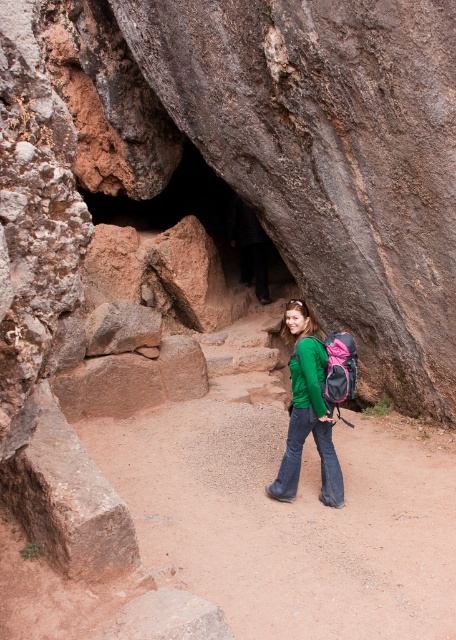
Question: Which point appears closest to the camera in this image?

Choices:
 (A) (294, 378)
 (B) (314, 436)

Answer: (A)

Question: Considering the relative positions of green matte shirt at center and green matte sweatshirt at center in the image provided, where is green matte shirt at center located with respect to green matte sweatshirt at center?

Choices:
 (A) left
 (B) right

Answer: (A)

Question: Which of the following is the farthest from the observer?

Choices:
 (A) (319, 378)
 (B) (295, 369)

Answer: (B)

Question: Is green matte shirt at center bigger than green matte sweatshirt at center?

Choices:
 (A) no
 (B) yes

Answer: (B)

Question: Which of the following is the farthest from the observer?

Choices:
 (A) (310, 392)
 (B) (322, 468)

Answer: (B)

Question: Can you confirm if green matte shirt at center is bigger than green matte sweatshirt at center?

Choices:
 (A) no
 (B) yes

Answer: (B)